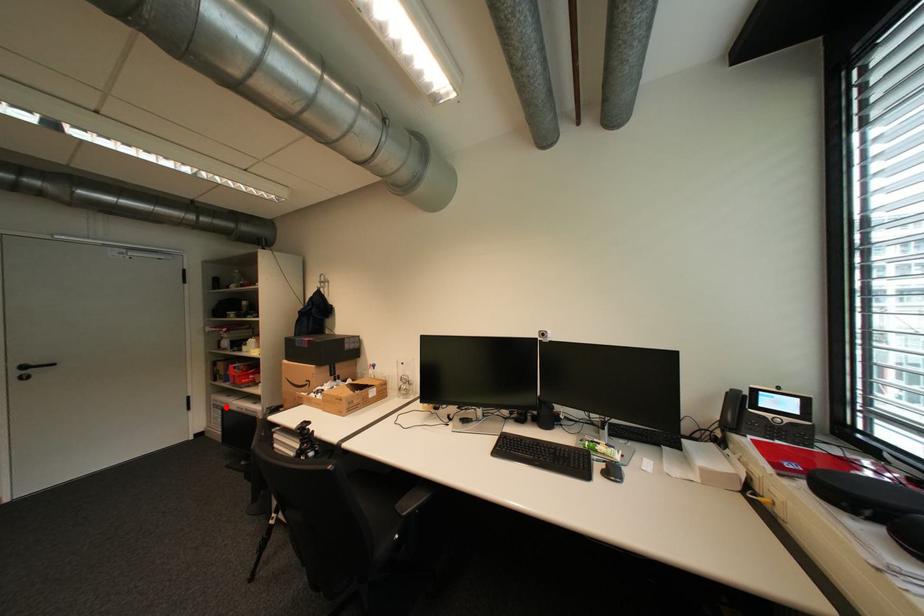
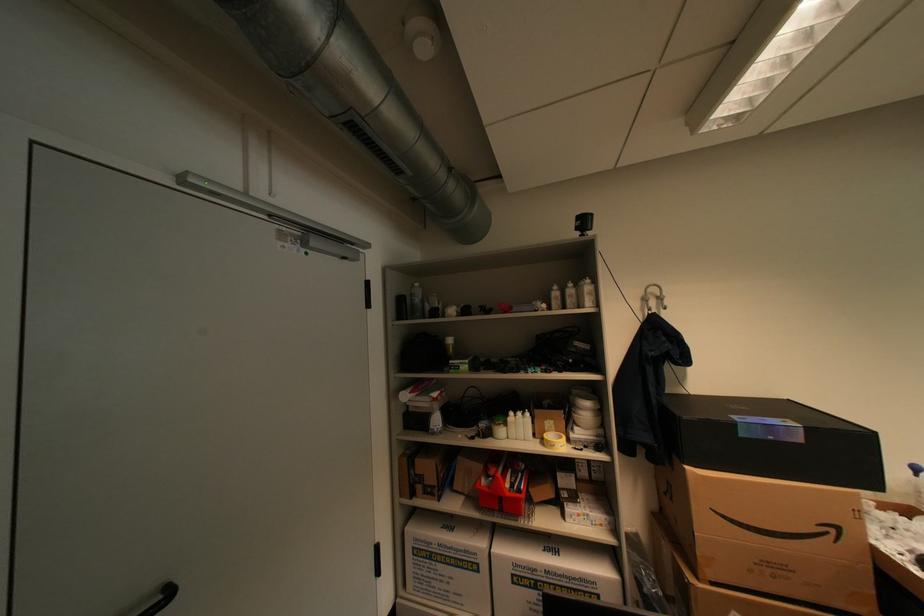
Question: A red point is marked in image1. In image2, is the corresponding 3D point closer to the camera or farther? Reply with the corresponding letter.

Choices:
 (A) The corresponding 3D point is closer.
 (B) The corresponding 3D point is farther.

Answer: (A)